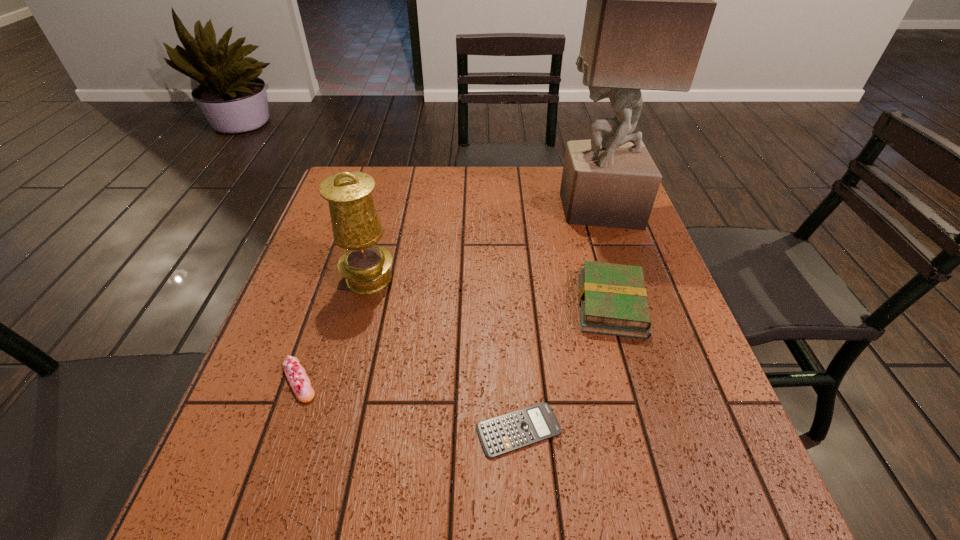
Locate an element on the screen. free space between the third object from right to left and the eclair is located at coordinates (409, 405).

Locate an element on the screen. vacant area between the book and the sculpture is located at coordinates (605, 256).

I want to click on free space between the book and the fourth tallest object, so click(x=455, y=342).

Image resolution: width=960 pixels, height=540 pixels. In order to click on free spot between the third shortest object and the third object from left to right in this screenshot , I will do `click(565, 367)`.

In order to click on the closest object to the third tallest object in this screenshot , I will do `click(518, 429)`.

Locate an element on the screen. The image size is (960, 540). object that is the third nearest to the third object from left to right is located at coordinates (356, 226).

Where is `free region that satisfies the following two spatial constraints: 1. on the front-facing side of the sculpture; 2. on the front side of the fourth tallest object`? free region that satisfies the following two spatial constraints: 1. on the front-facing side of the sculpture; 2. on the front side of the fourth tallest object is located at coordinates (655, 381).

Identify the location of free space that satisfies the following two spatial constraints: 1. on the front side of the shortest object; 2. on the left side of the fourth shortest object. The height and width of the screenshot is (540, 960). (330, 430).